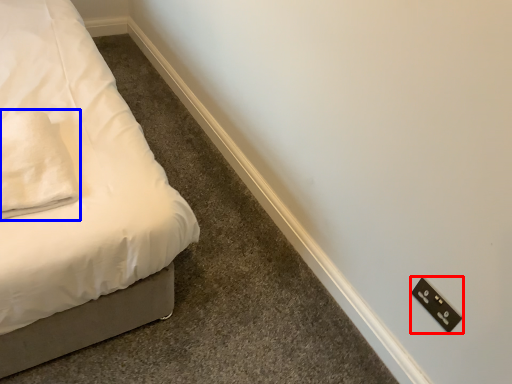
Question: Among these objects, which one is nearest to the camera, light switch (highlighted by a red box) or pillow (highlighted by a blue box)?

Choices:
 (A) light switch
 (B) pillow

Answer: (B)